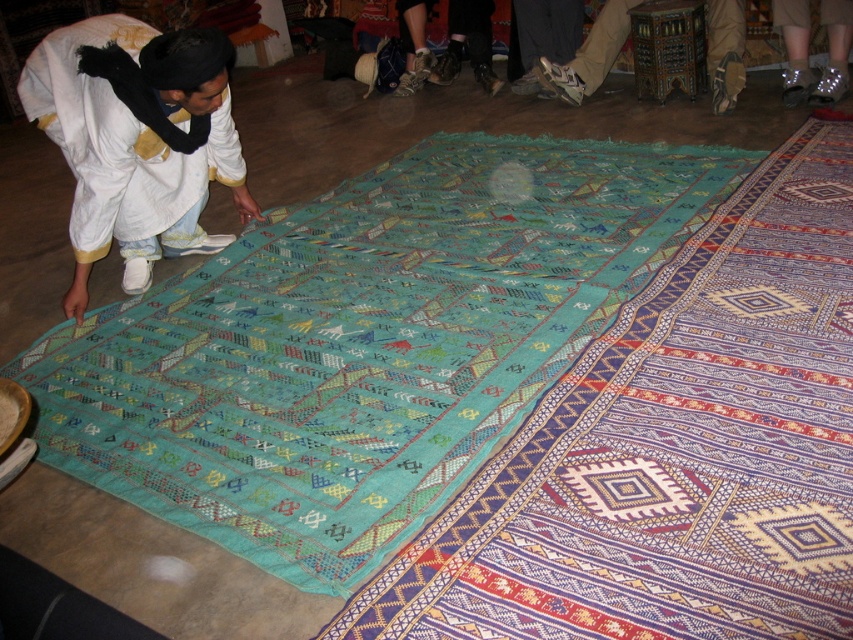
Question: Is leather boots at center smaller than metallic silver boots at lower right?

Choices:
 (A) no
 (B) yes

Answer: (A)

Question: Among these points, which one is nearest to the camera?

Choices:
 (A) pyautogui.click(x=410, y=83)
 (B) pyautogui.click(x=804, y=77)
 (C) pyautogui.click(x=761, y=580)

Answer: (C)

Question: Observing the image, what is the correct spatial positioning of multicolored woven rug at center in reference to leather boots at center?

Choices:
 (A) below
 (B) above

Answer: (A)

Question: Among these points, which one is farthest from the camera?

Choices:
 (A) (526, 522)
 (B) (431, 56)
 (C) (842, 36)

Answer: (B)

Question: Can you confirm if multicolored woven rug at center is smaller than metallic silver boots at lower right?

Choices:
 (A) no
 (B) yes

Answer: (A)

Question: Considering the real-world distances, which object is farthest from the white cotton clothing at center?

Choices:
 (A) multicolored woven rug at center
 (B) leather boots at center

Answer: (B)